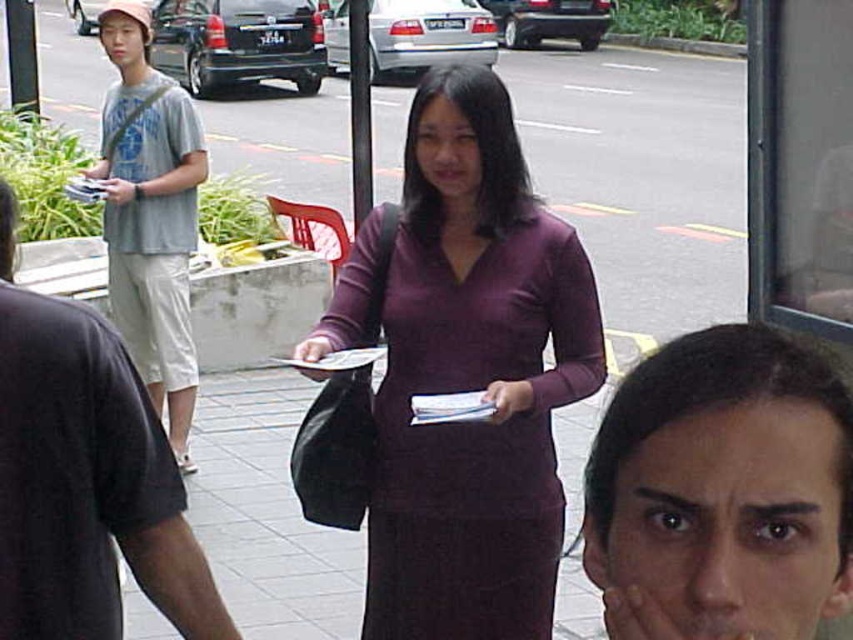
Question: Is smooth skin face at center to the right of denim shorts at left from the viewer's perspective?

Choices:
 (A) yes
 (B) no

Answer: (A)

Question: Among these points, which one is farthest from the camera?

Choices:
 (A) (161, 97)
 (B) (409, 616)
 (C) (30, 598)
 (D) (764, 388)

Answer: (A)

Question: Does smooth skin face at center lie behind denim shorts at left?

Choices:
 (A) no
 (B) yes

Answer: (A)

Question: Considering the real-world distances, which object is farthest from the light gray cotton t-shirt at left?

Choices:
 (A) denim shorts at left
 (B) smooth skin face at center

Answer: (B)

Question: In this image, where is smooth skin face at center located relative to denim shorts at left?

Choices:
 (A) below
 (B) above

Answer: (B)

Question: Estimate the real-world distances between objects in this image. Which object is closer to the light gray cotton t-shirt at left?

Choices:
 (A) purple matte dress at center
 (B) smooth skin face at center

Answer: (A)